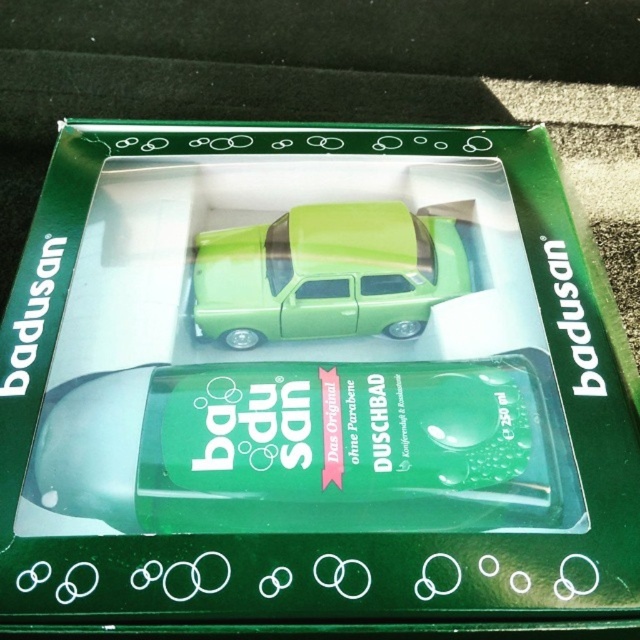
Question: Observing the image, what is the correct spatial positioning of green plastic car at center in reference to green glossy car at center?

Choices:
 (A) left
 (B) right

Answer: (A)

Question: Which object appears closest to the camera in this image?

Choices:
 (A) green plastic car at center
 (B) green glossy car at center

Answer: (A)

Question: Is green plastic car at center closer to camera compared to green glossy car at center?

Choices:
 (A) yes
 (B) no

Answer: (A)

Question: Which object is farther from the camera taking this photo?

Choices:
 (A) green plastic car at center
 (B) green glossy car at center

Answer: (B)

Question: Can you confirm if green plastic car at center is positioned to the right of green glossy car at center?

Choices:
 (A) yes
 (B) no

Answer: (B)

Question: Among these objects, which one is nearest to the camera?

Choices:
 (A) green plastic car at center
 (B) green glossy car at center

Answer: (A)